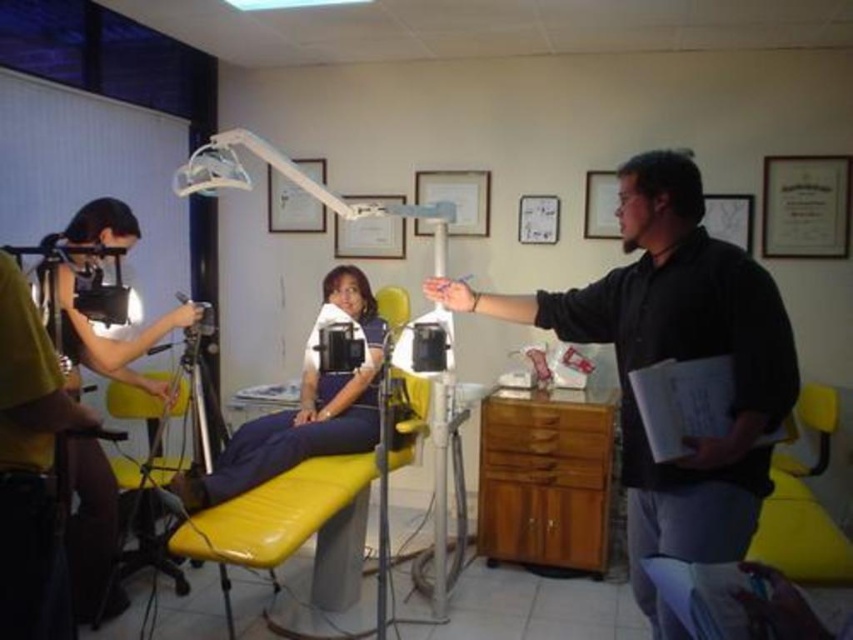
You are a patient entering the dental clinic and need to sit on the yellow vinyl chair at center. There is a black matte dentist at center nearby. Which object is bigger in size?

The black matte dentist at center is larger in size than the yellow vinyl chair at center.

Based on the scene description, where is the black matte dentist at center located in the image?

The black matte dentist at center is located at point [676,358] in the image.

You are a patient in a dental clinic and see the point marked at coordinates (676,358). What object is located at that point?

The point at coordinates (676,358) indicates the location of the black matte dentist at center.